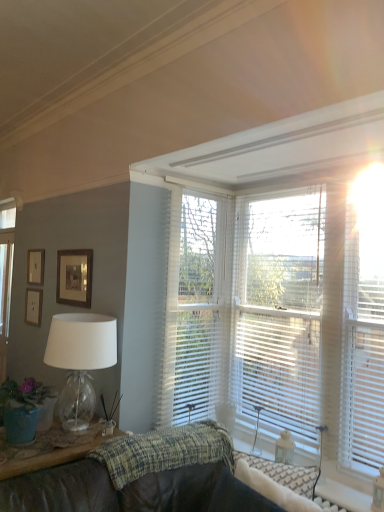
Question: Does textured woven blanket at center turn towards wooden picture frame at upper left, marked as the 3th picture frame in a front-to-back arrangement?

Choices:
 (A) no
 (B) yes

Answer: (A)

Question: Is textured woven blanket at center positioned far away from wooden picture frame at upper left, which is counted as the 1th picture frame, starting from the back?

Choices:
 (A) yes
 (B) no

Answer: (A)

Question: From a real-world perspective, is textured woven blanket at center located higher than wooden picture frame at upper left, which is counted as the 1th picture frame, starting from the back?

Choices:
 (A) yes
 (B) no

Answer: (B)

Question: From the image's perspective, would you say textured woven blanket at center is positioned over wooden picture frame at upper left, marked as the 3th picture frame in a front-to-back arrangement?

Choices:
 (A) yes
 (B) no

Answer: (B)

Question: Would you say wooden picture frame at upper left, which is counted as the 1th picture frame, starting from the back, is part of textured woven blanket at center's contents?

Choices:
 (A) no
 (B) yes

Answer: (A)

Question: Is the depth of textured woven blanket at center less than that of wooden picture frame at upper left, which appears as the third picture frame when viewed from the right?

Choices:
 (A) yes
 (B) no

Answer: (A)

Question: From a real-world perspective, is matte green pot at lower left on wooden framed picture at upper left, which is the first picture frame in front-to-back order?

Choices:
 (A) no
 (B) yes

Answer: (A)

Question: Considering the relative sizes of matte green pot at lower left and wooden framed picture at upper left, placed as the third picture frame when sorted from back to front, in the image provided, is matte green pot at lower left smaller than wooden framed picture at upper left, placed as the third picture frame when sorted from back to front,?

Choices:
 (A) no
 (B) yes

Answer: (A)

Question: Considering the relative sizes of matte green pot at lower left and wooden framed picture at upper left, which is the 3th picture frame from left to right, in the image provided, is matte green pot at lower left shorter than wooden framed picture at upper left, which is the 3th picture frame from left to right,?

Choices:
 (A) no
 (B) yes

Answer: (B)

Question: Is matte green pot at lower left at the right side of wooden framed picture at upper left, which is the 3th picture frame from left to right?

Choices:
 (A) no
 (B) yes

Answer: (B)

Question: Is wooden framed picture at upper left, the 1th picture frame positioned from the right, completely or partially inside matte green pot at lower left?

Choices:
 (A) yes
 (B) no

Answer: (B)

Question: Could you tell me if matte green pot at lower left is facing wooden framed picture at upper left, which is the 3th picture frame from left to right?

Choices:
 (A) yes
 (B) no

Answer: (B)

Question: Considering the relative sizes of white textured blinds at upper right and wooden picture frame at upper left, which is the 1th picture frame from left to right, in the image provided, is white textured blinds at upper right shorter than wooden picture frame at upper left, which is the 1th picture frame from left to right,?

Choices:
 (A) yes
 (B) no

Answer: (B)